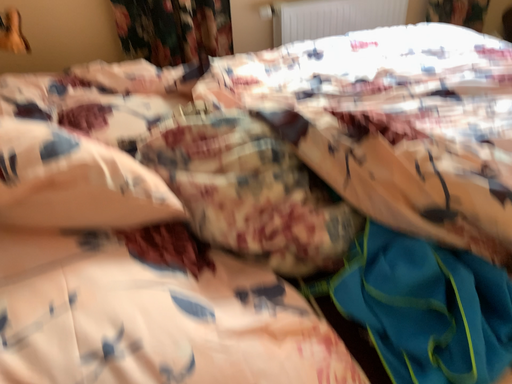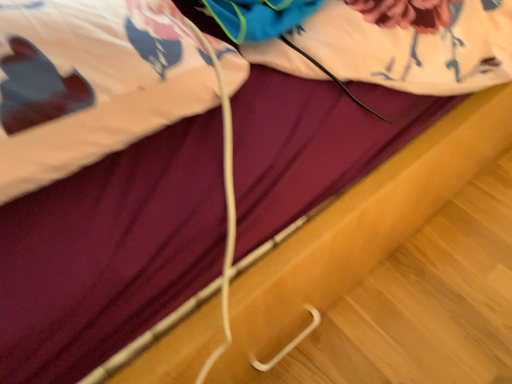
Question: Which way did the camera rotate in the video?

Choices:
 (A) rotated upward
 (B) rotated downward

Answer: (B)